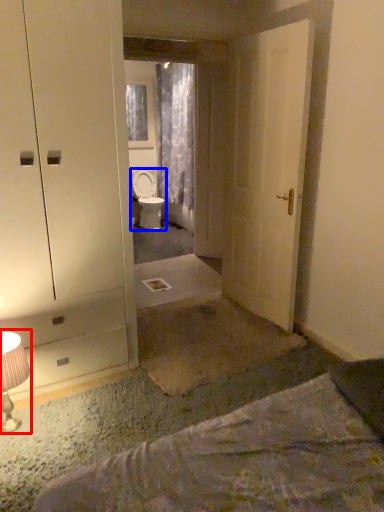
Question: Which point is closer to the camera, table lamp (highlighted by a red box) or toilet (highlighted by a blue box)?

Choices:
 (A) table lamp
 (B) toilet

Answer: (A)